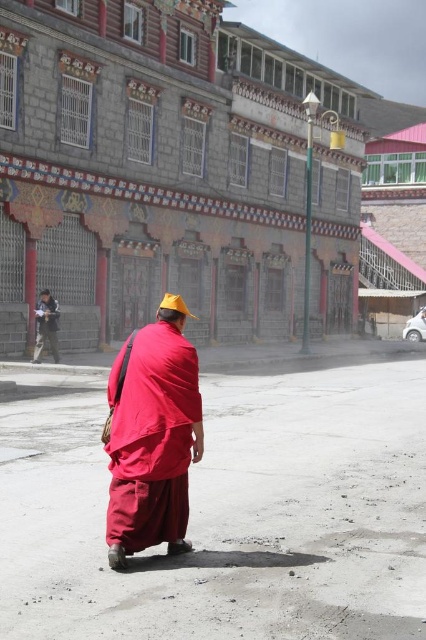
Where is the matte black monk at left located in the image?

The matte black monk at left is located at point 0.509 on the x axis and 0.108 on the y axis.